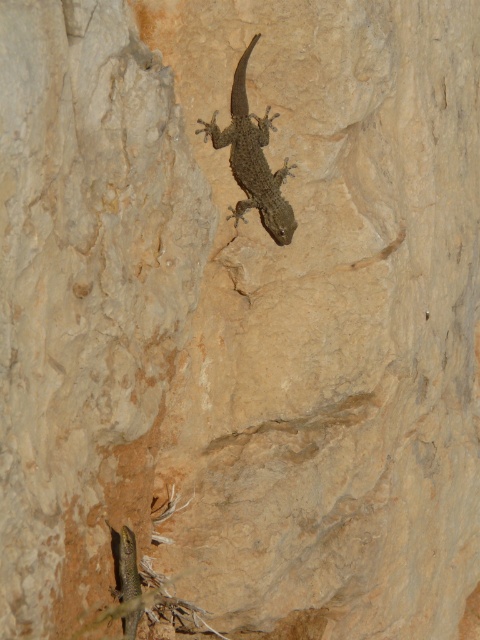
You are a nature photographer aiming to capture both the smooth brown lizard at center and the green scaly lizard at lower left in a single frame. Given their sizes, which lizard will appear larger in your photo?

The smooth brown lizard at center will appear larger in the photo because it is bigger than the green scaly lizard at lower left.

You are a hiker who just spotted two lizards in a rocky cave. You see the smooth brown lizard at center and the green scaly lizard at lower left. Which lizard is farther away from you?

The green scaly lizard at lower left is farther away because it is positioned behind the smooth brown lizard at center, making it appear deeper in the scene.